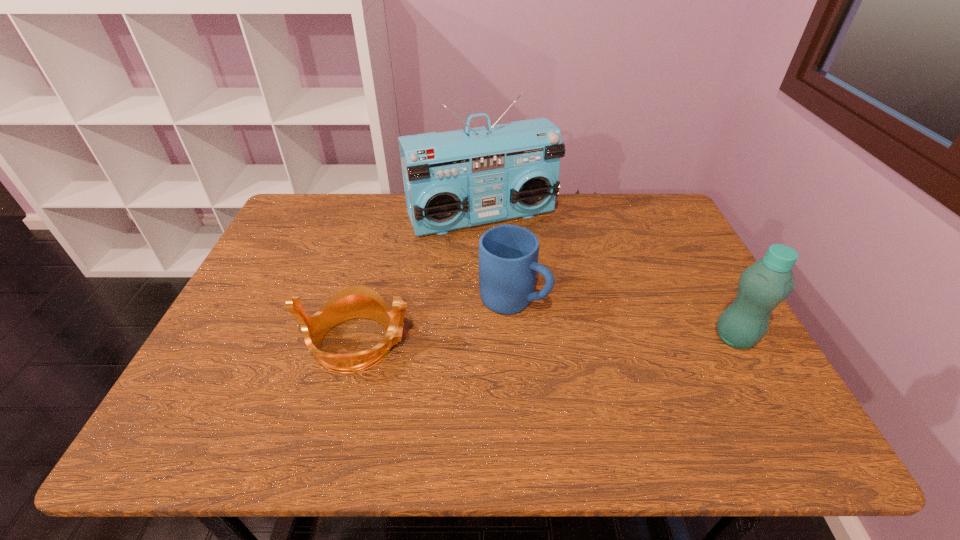
At what (x,y) coordinates should I click in order to perform the action: click on vacant space located on the side of the mug with the handle. Please return your answer as a coordinate pair (x, y). The width and height of the screenshot is (960, 540). Looking at the image, I should click on (609, 354).

Image resolution: width=960 pixels, height=540 pixels. I want to click on free space located on the side of the mug with the handle, so click(x=621, y=360).

At what (x,y) coordinates should I click in order to perform the action: click on free space located 0.090m on the side of the mug with the handle. Please return your answer as a coordinate pair (x, y). Looking at the image, I should click on (571, 333).

Identify the location of object situated at the far edge. point(455,179).

In order to click on object positioned at the near edge in this screenshot , I will do `click(353, 302)`.

The width and height of the screenshot is (960, 540). What are the coordinates of `object situated at the right edge` in the screenshot? It's located at (762, 286).

The width and height of the screenshot is (960, 540). In the image, there is a desktop. What are the coordinates of `vacant space at the far edge` in the screenshot? It's located at (387, 232).

In order to click on free space at the near edge of the desktop in this screenshot , I will do `click(284, 373)`.

Identify the location of vacant space at the left edge. The image size is (960, 540). point(230,341).

This screenshot has height=540, width=960. Identify the location of free space at the right edge of the desktop. (648, 262).